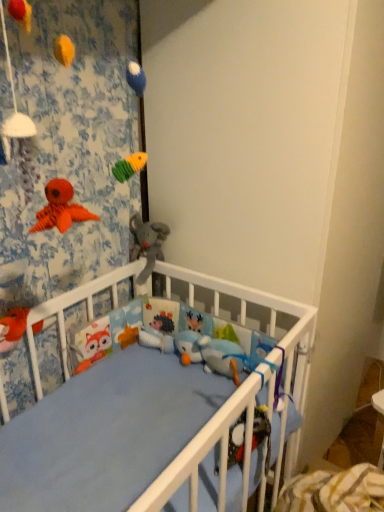
Question: From a real-world perspective, is soft plush elephant at center, positioned as the 1th toy in top-to-bottom order, on top of fluffy orange fox at lower left, placed as the first toy when sorted from left to right?

Choices:
 (A) yes
 (B) no

Answer: (A)

Question: Is soft plush elephant at center, positioned as the 1th toy in top-to-bottom order, bigger than fluffy orange fox at lower left, acting as the 2th toy starting from the bottom?

Choices:
 (A) yes
 (B) no

Answer: (A)

Question: Is fluffy orange fox at lower left, which is the 3th toy in back-to-front order, completely or partially inside soft plush elephant at center, the second toy viewed from the front?

Choices:
 (A) yes
 (B) no

Answer: (B)

Question: Is the depth of soft plush elephant at center, which ranks as the third toy in bottom-to-top order, less than that of fluffy orange fox at lower left, acting as the 3th toy starting from the right?

Choices:
 (A) yes
 (B) no

Answer: (B)

Question: Does soft plush elephant at center, which is counted as the second toy, starting from the back, appear on the left side of fluffy orange fox at lower left, acting as the 2th toy starting from the bottom?

Choices:
 (A) no
 (B) yes

Answer: (A)

Question: Looking at the image, does soft plush elephant at center, which is counted as the second toy, starting from the back, seem bigger or smaller compared to white plush hedgehog at center, the 3th toy from the left?

Choices:
 (A) small
 (B) big

Answer: (B)

Question: Considering the positions of point (142, 226) and point (122, 338), is point (142, 226) closer or farther from the camera than point (122, 338)?

Choices:
 (A) farther
 (B) closer

Answer: (B)

Question: From the image's perspective, is soft plush elephant at center, which is counted as the second toy, starting from the back, above or below white plush hedgehog at center, positioned as the 1th toy in bottom-to-top order?

Choices:
 (A) above
 (B) below

Answer: (A)

Question: Considering the positions of soft plush elephant at center, the 2th toy from the right, and white plush hedgehog at center, positioned as the 1th toy in right-to-left order, in the image, is soft plush elephant at center, the 2th toy from the right, taller or shorter than white plush hedgehog at center, positioned as the 1th toy in right-to-left order,?

Choices:
 (A) tall
 (B) short

Answer: (A)

Question: Relative to fluffy orange fox at lower left, which is the 3th toy in back-to-front order, is white matte wall at upper center in front or behind?

Choices:
 (A) front
 (B) behind

Answer: (A)

Question: Based on their sizes in the image, would you say white matte wall at upper center is bigger or smaller than fluffy orange fox at lower left, which is the second toy in top-to-bottom order?

Choices:
 (A) big
 (B) small

Answer: (A)

Question: Based on their positions, is white matte wall at upper center located to the left or right of fluffy orange fox at lower left, placed as the first toy when sorted from left to right?

Choices:
 (A) right
 (B) left

Answer: (A)

Question: From the image's perspective, is white matte wall at upper center positioned above or below fluffy orange fox at lower left, which is the second toy in top-to-bottom order?

Choices:
 (A) above
 (B) below

Answer: (A)

Question: Would you say fluffy orange fox at lower left, placed as the first toy when sorted from left to right, is to the left or to the right of white plush hedgehog at center, positioned as the 1th toy in bottom-to-top order, in the picture?

Choices:
 (A) right
 (B) left

Answer: (B)

Question: Considering the positions of fluffy orange fox at lower left, positioned as the 1th toy in front-to-back order, and white plush hedgehog at center, which appears as the first toy when viewed from the back, in the image, is fluffy orange fox at lower left, positioned as the 1th toy in front-to-back order, wider or thinner than white plush hedgehog at center, which appears as the first toy when viewed from the back,?

Choices:
 (A) thin
 (B) wide

Answer: (B)